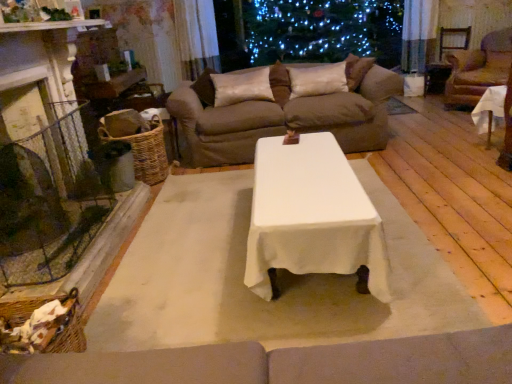
Question: Considering their positions, is woven brown basket at left located in front of or behind brown leather armchair at right?

Choices:
 (A) behind
 (B) front

Answer: (B)

Question: Considering the relative positions of woven brown basket at left and brown leather armchair at right in the image provided, is woven brown basket at left to the left or to the right of brown leather armchair at right?

Choices:
 (A) right
 (B) left

Answer: (B)

Question: Estimate the real-world distances between objects in this image. Which object is closer to the brown fabric couch at upper center?

Choices:
 (A) white cloth-covered table at right
 (B) satin curtain at upper center
 (C) brown leather armchair at right
 (D) silky beige pillow at center, placed as the 2th pillow when sorted from left to right
 (E) satin cushion at center, the first pillow positioned from the left

Answer: (E)

Question: Which is nearer to the brown fabric couch at upper center?

Choices:
 (A) silky beige pillow at center, the 1th pillow in the right-to-left sequence
 (B) white cloth-covered table at right
 (C) satin curtain at upper center
 (D) brown leather armchair at right
 (E) woven brown basket at left

Answer: (A)